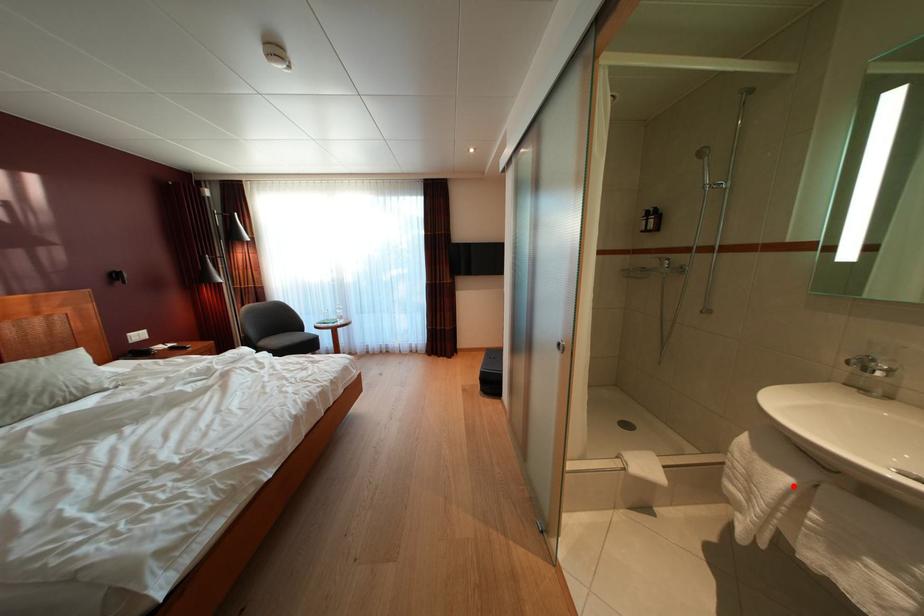
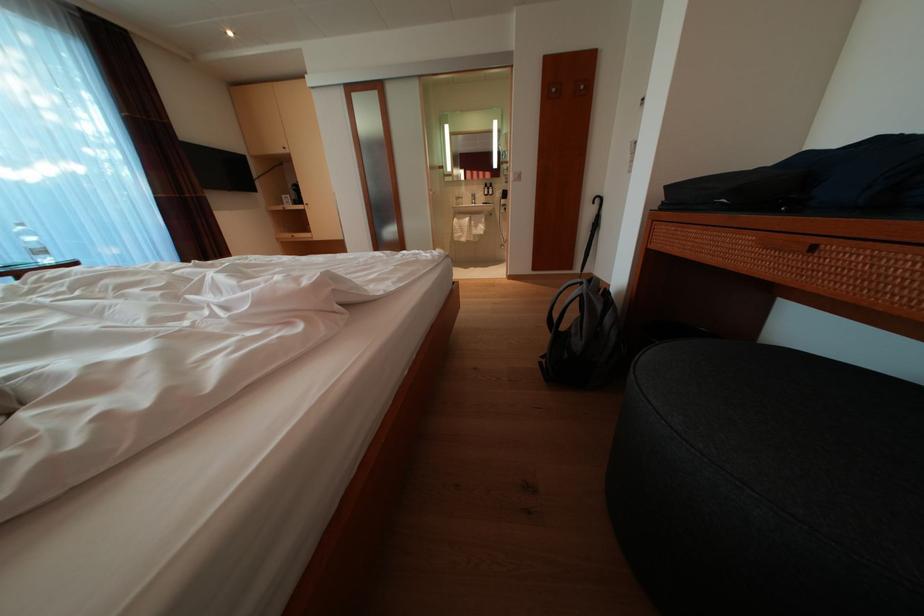
Question: I am providing you with two images of the same scene from different viewpoints. Image1 has a red point marked. In image2, the corresponding 3D location appears at what relative position? Reply with the corresponding letter.

Choices:
 (A) Closer
 (B) Farther

Answer: (A)